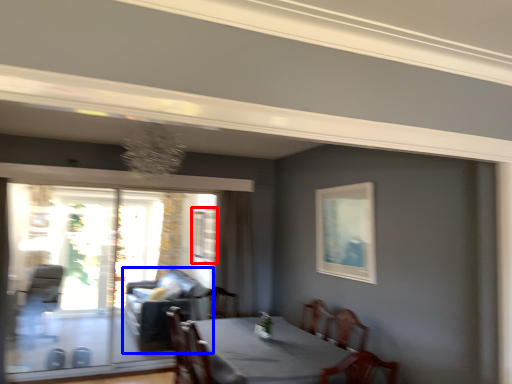
Question: Which object appears farthest to the camera in this image, window (highlighted by a red box) or couch (highlighted by a blue box)?

Choices:
 (A) window
 (B) couch

Answer: (A)